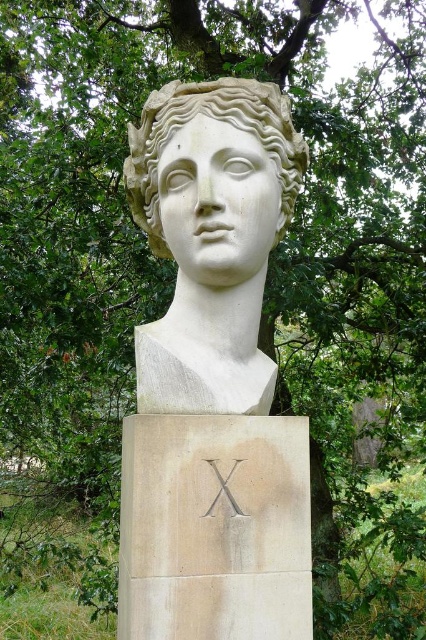
Does white marble bust at center have a greater width compared to white marble head at center?

Yes, white marble bust at center is wider than white marble head at center.

Where is `white marble bust at center`? This screenshot has height=640, width=426. white marble bust at center is located at coordinates (213, 378).